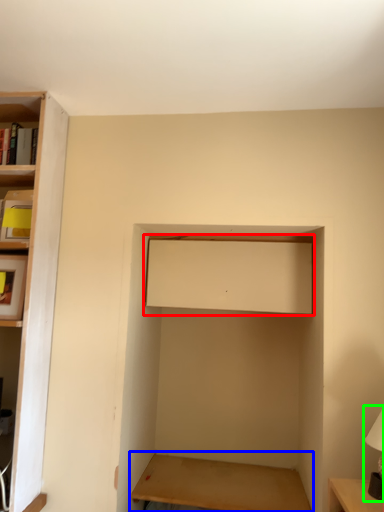
Question: Which object is the closest to the cabinet (highlighted by a red box)? Choose among these: table (highlighted by a blue box) or table lamp (highlighted by a green box).

Choices:
 (A) table
 (B) table lamp

Answer: (B)